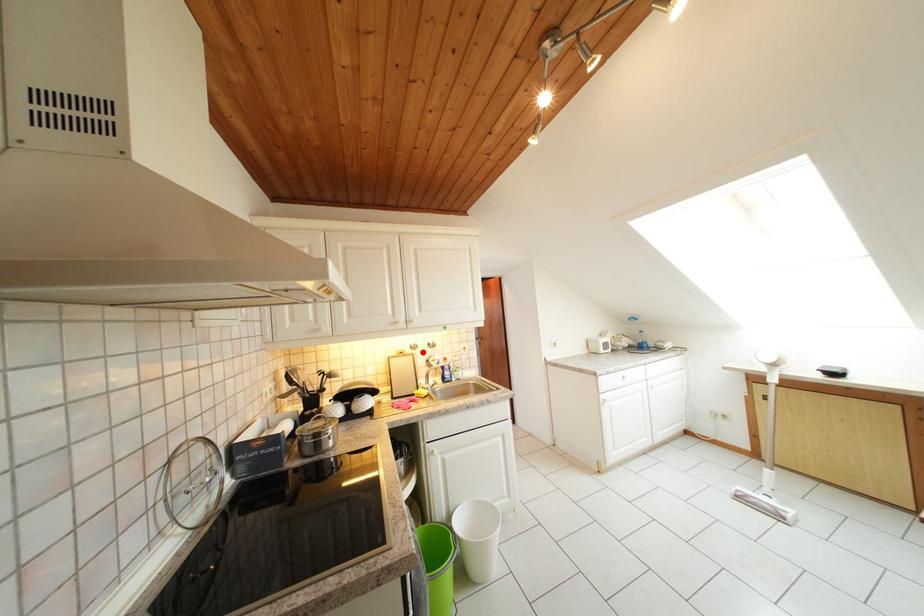
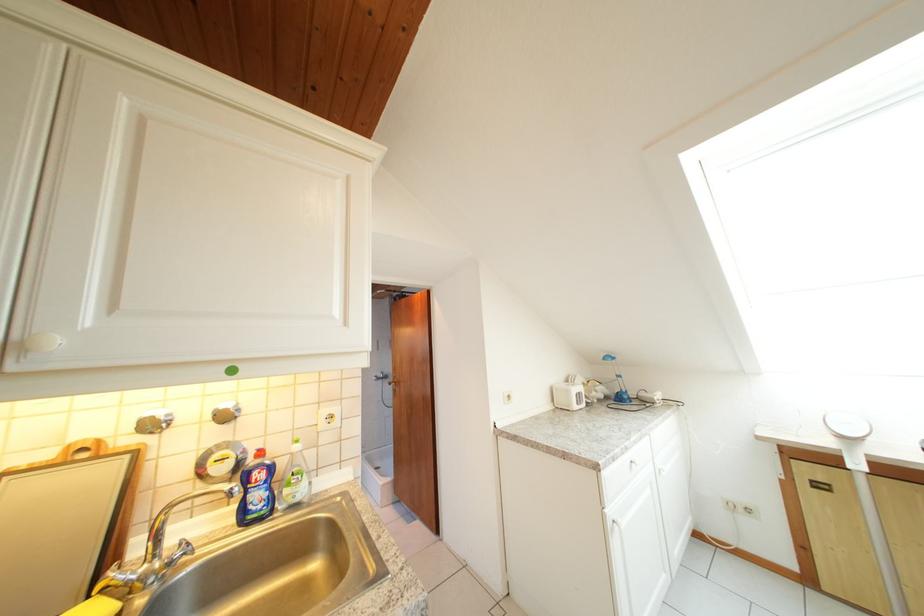
In the second image, find the point that corresponds to the highlighted location in the first image.

(162, 431)